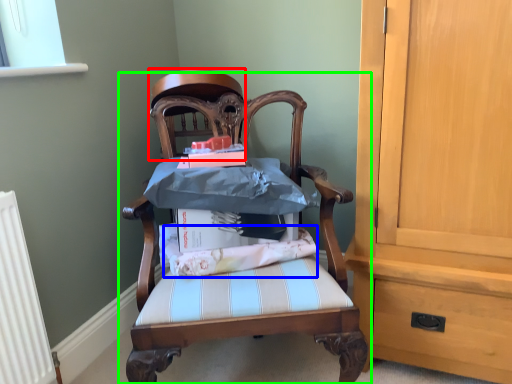
Question: Considering the real-world distances, which object is farthest from chair (highlighted by a red box)? fabric (highlighted by a blue box) or chair (highlighted by a green box)?

Choices:
 (A) fabric
 (B) chair

Answer: (A)